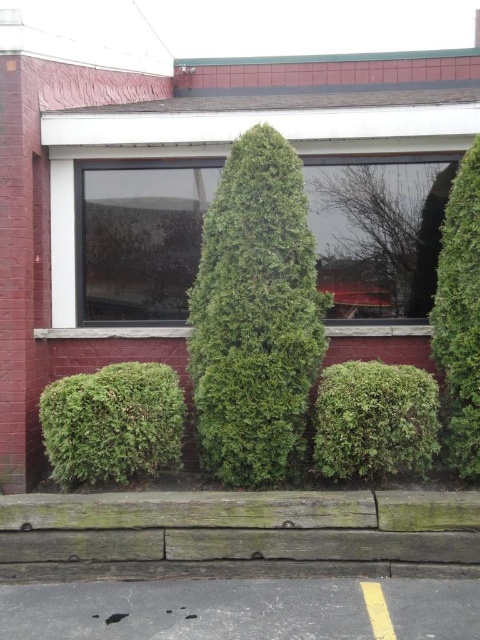
Question: Which of the following is the farthest from the observer?

Choices:
 (A) green leafy shrub at center
 (B) green textured bush at lower left

Answer: (B)

Question: Does transparent glass window at center lie in front of green leafy shrub at center?

Choices:
 (A) yes
 (B) no

Answer: (B)

Question: Among these points, which one is nearest to the camera?

Choices:
 (A) (76, 401)
 (B) (396, 444)
 (C) (252, 244)
 (D) (265, 536)

Answer: (D)

Question: Where is transparent glass window at center located in relation to green leafy shrub at right in the image?

Choices:
 (A) left
 (B) right

Answer: (A)

Question: Does weathered wood curb at lower center have a lesser width compared to transparent glass window at center?

Choices:
 (A) yes
 (B) no

Answer: (B)

Question: Which point is farther to the camera?

Choices:
 (A) (4, 522)
 (B) (371, 477)
 (C) (342, 166)

Answer: (C)